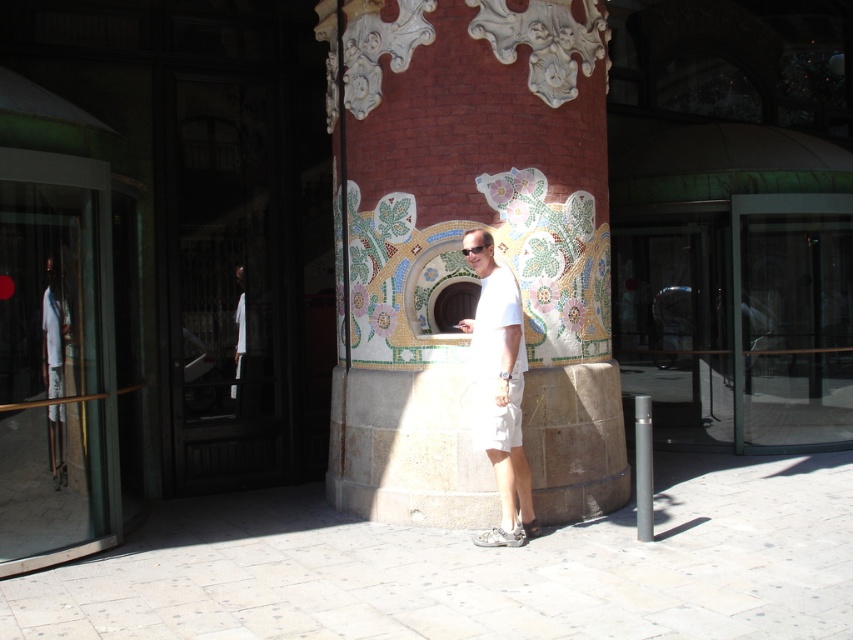
Does point (361, 198) come closer to viewer compared to point (466, 253)?

No, it is not.

Find the location of a particular element. The width and height of the screenshot is (853, 640). mosaic tile column at center is located at coordinates (460, 244).

Measure the distance between mosaic tile column at center and camera.

mosaic tile column at center and camera are 18.85 feet apart.

Find the location of a particular element. mosaic tile column at center is located at coordinates (460, 244).

Where is `transparent glass door at left`? The width and height of the screenshot is (853, 640). transparent glass door at left is located at coordinates (55, 362).

Can you confirm if transparent glass door at left is bigger than matte black goggles at center?

Yes.

The width and height of the screenshot is (853, 640). In order to click on transparent glass door at left in this screenshot , I will do [55, 362].

Does white cotton shirt at left have a lesser width compared to matte black goggles at center?

Incorrect, white cotton shirt at left's width is not less than matte black goggles at center's.

Is white cotton shirt at left taller than matte black goggles at center?

Yes.

Describe the element at coordinates (54, 365) in the screenshot. I see `white cotton shirt at left` at that location.

Locate an element on the screen. This screenshot has height=640, width=853. white cotton shirt at left is located at coordinates (54, 365).